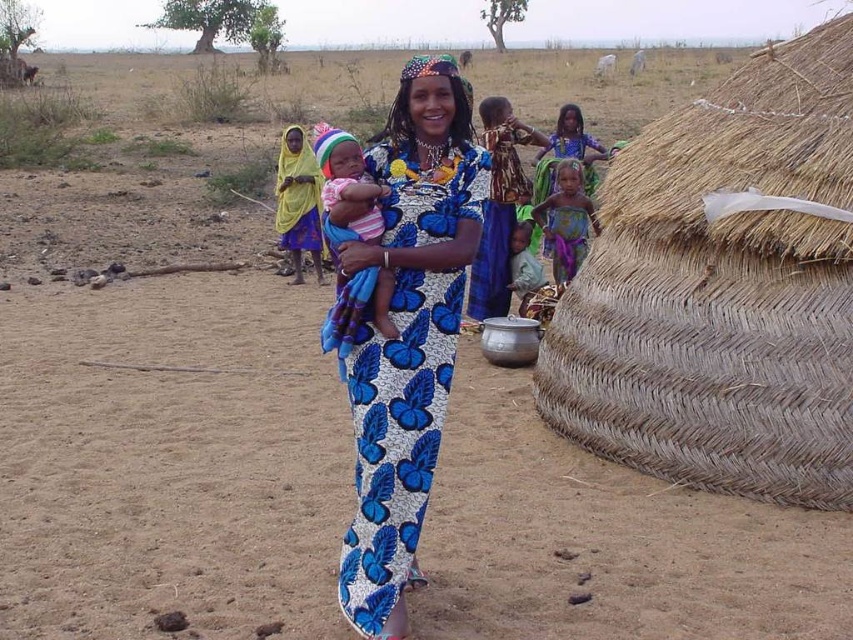
You are an observer standing in front of the image. You notice the purple fabric dress at center and the light green fabric at lower center. Which fabric is positioned higher in the image?

The purple fabric dress at center is positioned higher than the light green fabric at lower center.

You are a photographer standing at the origin point in the center of the image. You want to capture a photo of the purple fabric dress at center. Which direction should you move to get closer to the dress?

The purple fabric dress at center is located at point 0.345 on the x axis and 0.665 on the y axis. Since the photographer is at the origin point in the center of the image, which is typically at coordinates (426, 320), the dress is to the left and below the photographer. To move closer, the photographer should move to the left and downward.

You are a photographer trying to capture the striped fabric baby at center and the light green fabric at lower center in the same frame. Which object should you focus on first if you want to ensure both are in focus?

A: The striped fabric baby at center is shorter than light green fabric at lower center, so you should focus on the light green fabric at lower center first to ensure both are in focus.